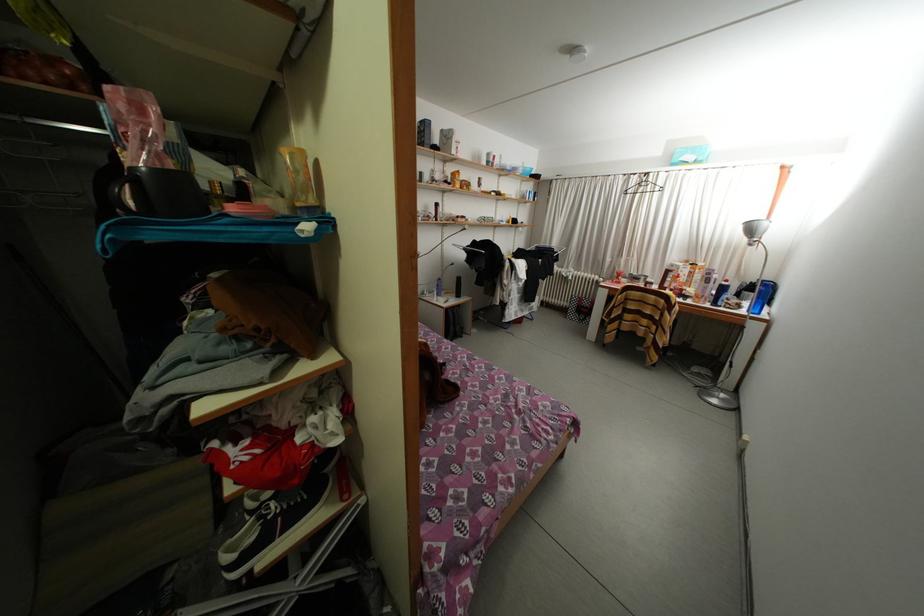
The location [761,296] corresponds to which object?

This point indicates the blue bowl.